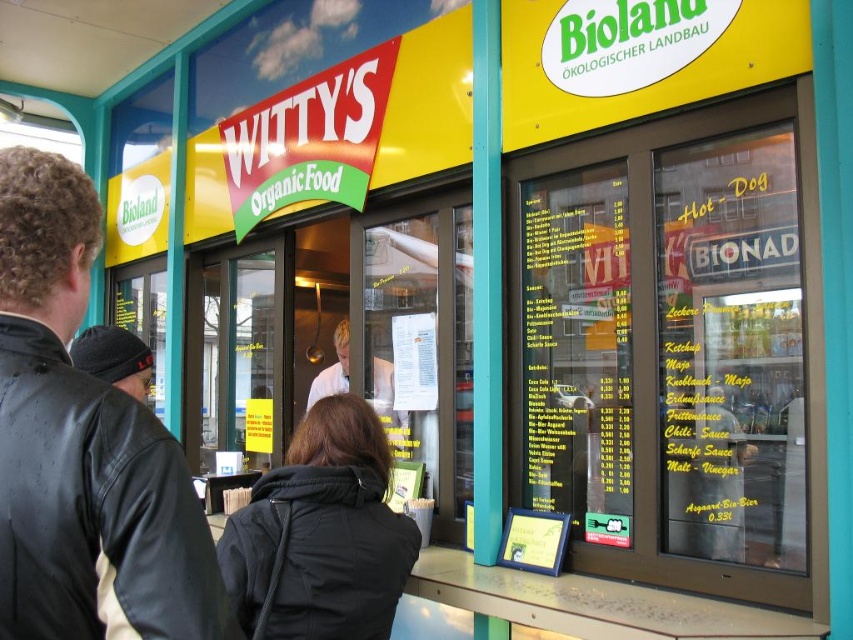
You are a customer at Witty Organic Food and you want to read the menu. Which object should you look at first, the white paper menu at center or the white uniform at center?

Answer: The white paper menu at center is positioned on the right side of white uniform at center, so you should look at the white uniform at center first as it is on the left side.